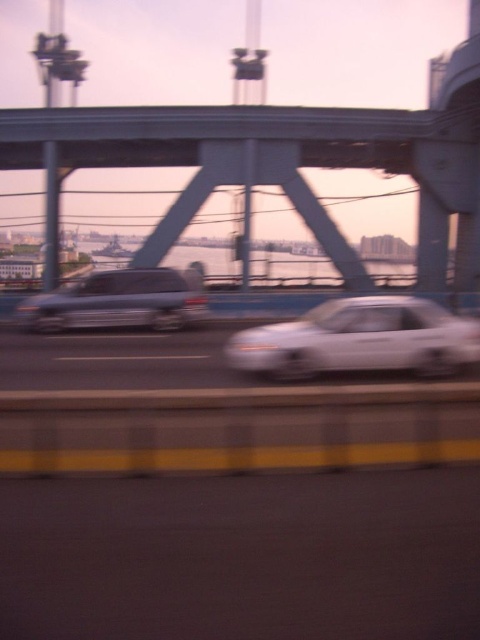
Question: Which of the following is the closest to the observer?

Choices:
 (A) (266, 129)
 (B) (381, 317)

Answer: (B)

Question: Is white glossy sedan at center to the left of satin silver van at center from the viewer's perspective?

Choices:
 (A) yes
 (B) no

Answer: (B)

Question: Considering the real-world distances, which object is closest to the satin silver van at center?

Choices:
 (A) white glossy sedan at center
 (B) metallic gray bridge at center

Answer: (A)

Question: Based on their relative distances, which object is nearer to the satin silver van at center?

Choices:
 (A) white glossy sedan at center
 (B) metallic gray bridge at center

Answer: (A)

Question: From the image, what is the correct spatial relationship of white glossy sedan at center in relation to satin silver van at center?

Choices:
 (A) right
 (B) left

Answer: (A)

Question: Is metallic gray bridge at center positioned at the back of white glossy sedan at center?

Choices:
 (A) no
 (B) yes

Answer: (B)